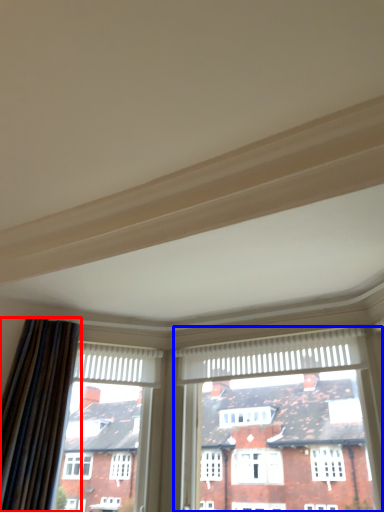
Question: Which object is closer to the camera taking this photo, curtain (highlighted by a red box) or window (highlighted by a blue box)?

Choices:
 (A) curtain
 (B) window

Answer: (A)